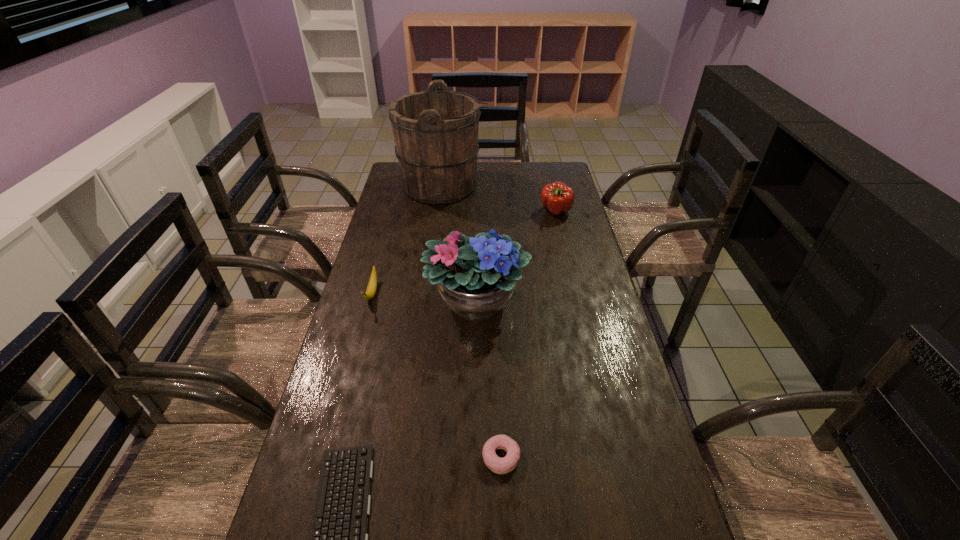
This screenshot has height=540, width=960. Identify the location of free spot between the doughnut and the second tallest object. (489, 378).

The height and width of the screenshot is (540, 960). What are the coordinates of `free space that is in between the fifth tallest object and the tallest object` in the screenshot? It's located at (472, 321).

Identify the location of free space that is in between the banana and the tallest object. Image resolution: width=960 pixels, height=540 pixels. (407, 240).

I want to click on free spot between the bouquet and the doughnut, so click(x=489, y=378).

This screenshot has width=960, height=540. Identify the location of vacant space in between the doughnut and the banana. (437, 375).

Select which object appears as the fifth closest to the bucket. Please provide its 2D coordinates. Your answer should be formatted as a tuple, i.e. [(x, y)], where the tuple contains the x and y coordinates of a point satisfying the conditions above.

[(338, 539)]

This screenshot has width=960, height=540. I want to click on object that is the fourth closest one to the fifth tallest object, so click(x=558, y=198).

What are the coordinates of `vacant point that satisfies the following two spatial constraints: 1. on the front side of the doughnut; 2. on the right side of the tallest object` in the screenshot? It's located at (409, 457).

The image size is (960, 540). In order to click on free space that satisfies the following two spatial constraints: 1. at the stem of the doughnut; 2. on the left side of the banana in this screenshot , I will do `click(327, 457)`.

In order to click on vacant region that satisfies the following two spatial constraints: 1. at the stem of the banana; 2. on the left side of the doughnut in this screenshot , I will do `click(327, 457)`.